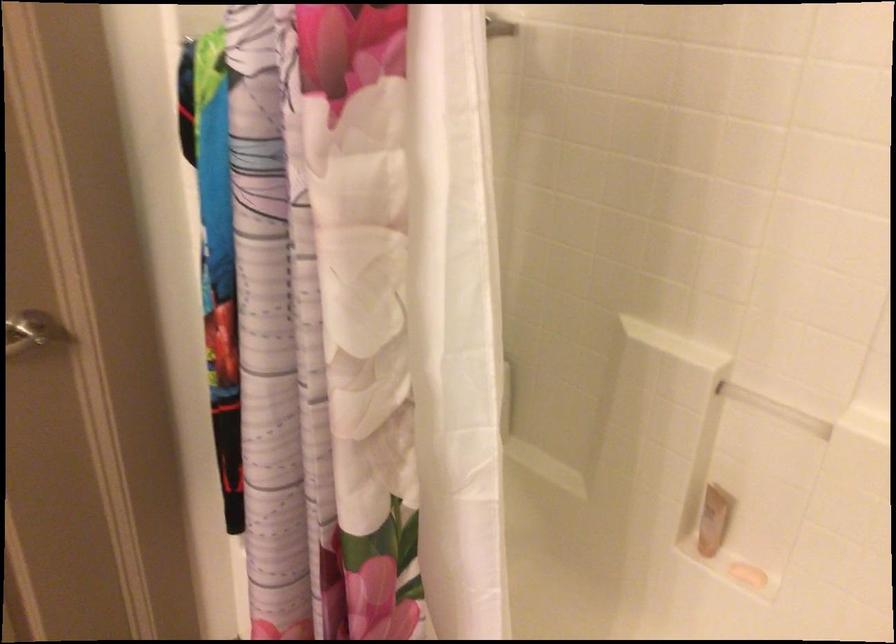
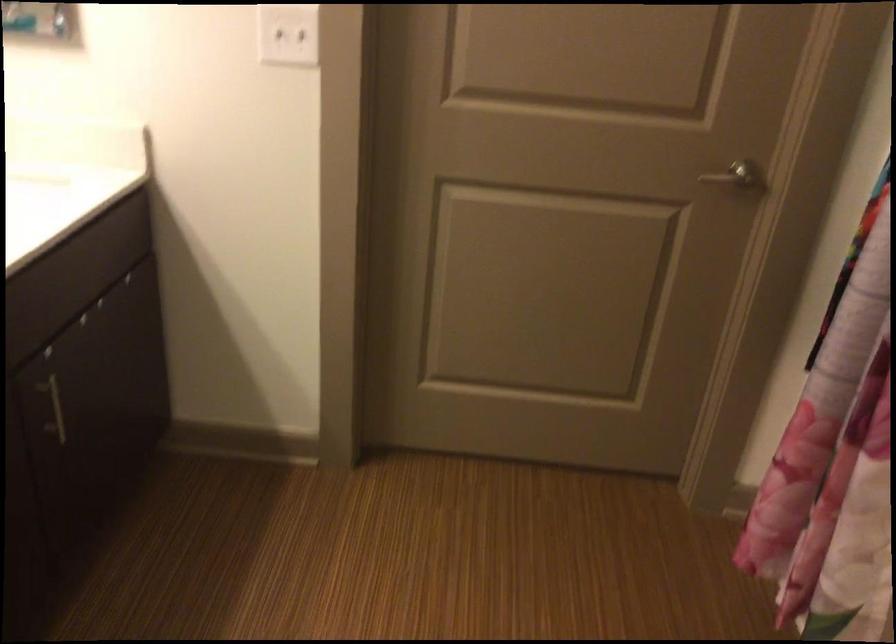
Question: The images are taken continuously from a first-person perspective. In which direction is your viewpoint rotating?

Choices:
 (A) Left
 (B) Right
 (C) Up
 (D) Down

Answer: (A)